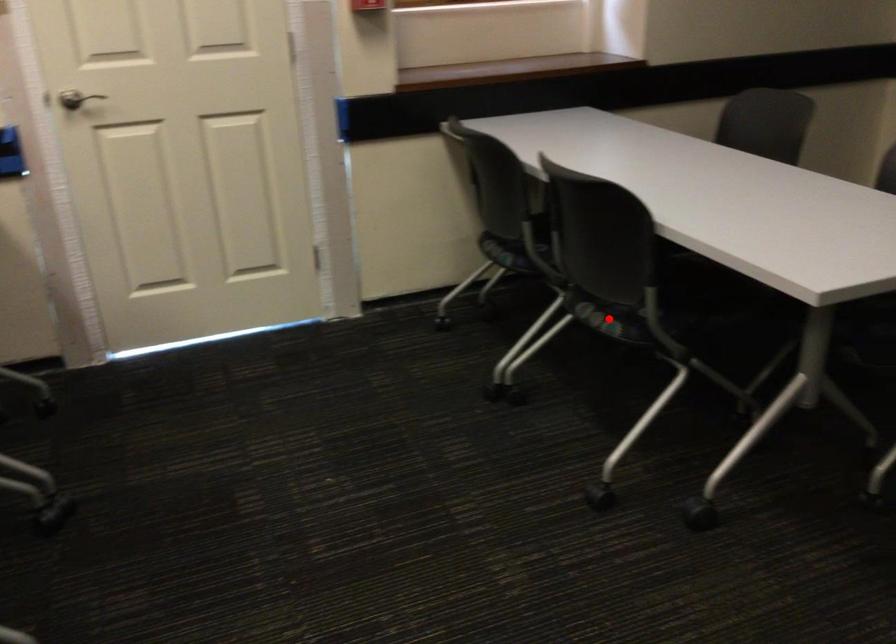
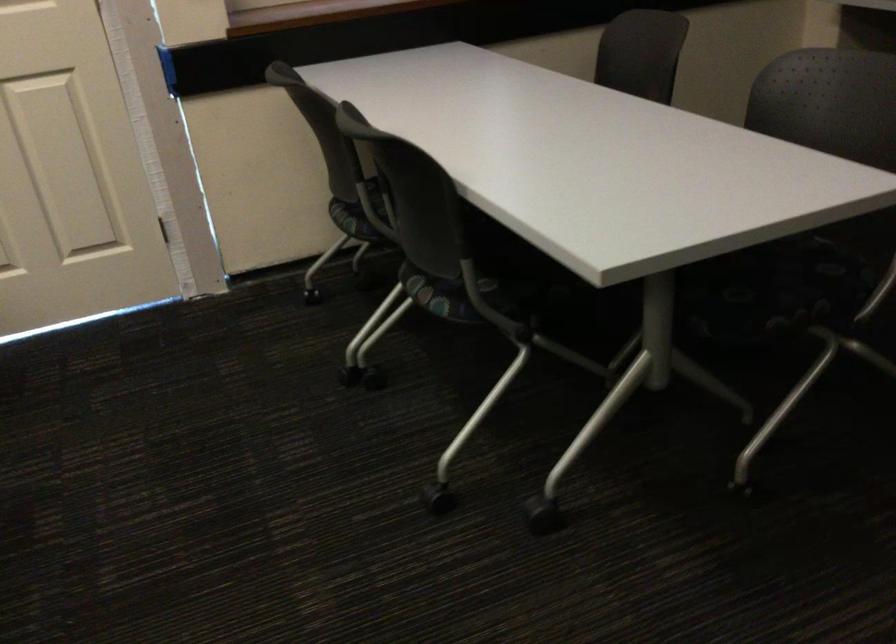
Where in the second image is the point corresponding to the highlighted location from the first image?

(442, 295)